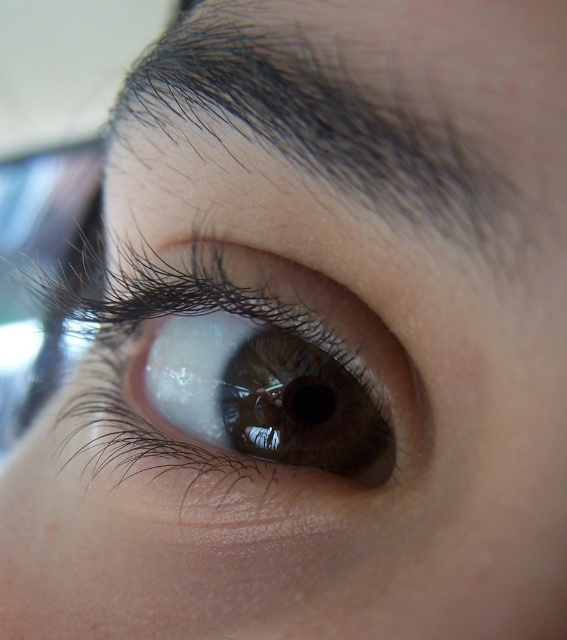
Question: Observing the image, what is the correct spatial positioning of dark brown hair at upper center in reference to brown glossy eye at center?

Choices:
 (A) right
 (B) left

Answer: (A)

Question: Can you confirm if dark brown hair at upper center is positioned below brown glossy eye at center?

Choices:
 (A) no
 (B) yes

Answer: (A)

Question: Which of the following is the farthest from the observer?

Choices:
 (A) (496, 88)
 (B) (219, 371)

Answer: (B)

Question: Is dark brown hair at upper center behind brown glossy eye at center?

Choices:
 (A) yes
 (B) no

Answer: (B)

Question: Which object appears farthest from the camera in this image?

Choices:
 (A) brown glossy eye at center
 (B) dark brown hair at upper center

Answer: (A)